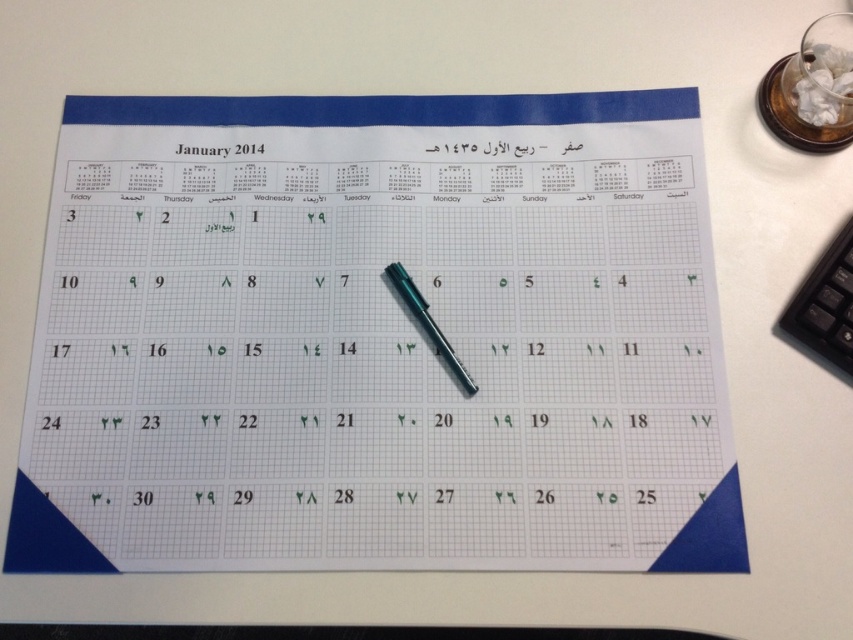
Question: Is black plastic calculator at right smaller than teal metallic pen at center?

Choices:
 (A) no
 (B) yes

Answer: (A)

Question: Among these objects, which one is nearest to the camera?

Choices:
 (A) green paper at center
 (B) teal metallic pen at center

Answer: (A)

Question: Among these objects, which one is nearest to the camera?

Choices:
 (A) green paper at center
 (B) teal metallic pen at center

Answer: (A)

Question: Is teal metallic pen at center bigger than green paper at center?

Choices:
 (A) yes
 (B) no

Answer: (A)

Question: Which is nearer to the teal metallic pen at center?

Choices:
 (A) green paper at center
 (B) black plastic calculator at right

Answer: (A)

Question: Observing the image, what is the correct spatial positioning of teal metallic pen at center in reference to green paper at center?

Choices:
 (A) below
 (B) above

Answer: (B)